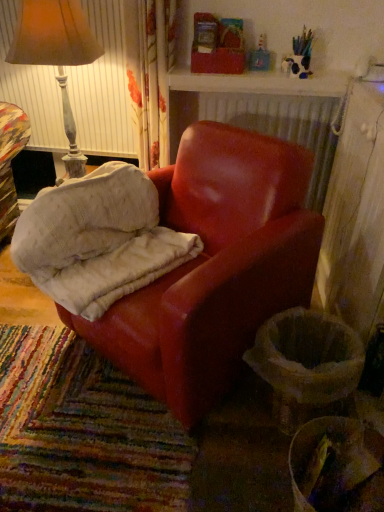
Question: From a real-world perspective, is matte leather chair at center on top of matte brown lampshade at upper left?

Choices:
 (A) yes
 (B) no

Answer: (B)

Question: Is matte leather chair at center closer to camera compared to matte brown lampshade at upper left?

Choices:
 (A) yes
 (B) no

Answer: (A)

Question: Can you confirm if matte leather chair at center is wider than matte brown lampshade at upper left?

Choices:
 (A) no
 (B) yes

Answer: (B)

Question: Is matte leather chair at center further to camera compared to matte brown lampshade at upper left?

Choices:
 (A) yes
 (B) no

Answer: (B)

Question: Considering the relative sizes of matte leather chair at center and matte brown lampshade at upper left in the image provided, is matte leather chair at center bigger than matte brown lampshade at upper left?

Choices:
 (A) yes
 (B) no

Answer: (A)

Question: From a real-world perspective, is matte leather chair at center beneath matte brown lampshade at upper left?

Choices:
 (A) yes
 (B) no

Answer: (A)

Question: Is matte brown lampshade at upper left positioned with its back to matte leather chair at center?

Choices:
 (A) yes
 (B) no

Answer: (B)

Question: Considering the relative sizes of matte brown lampshade at upper left and matte leather chair at center in the image provided, is matte brown lampshade at upper left smaller than matte leather chair at center?

Choices:
 (A) yes
 (B) no

Answer: (A)

Question: Considering the relative sizes of matte brown lampshade at upper left and matte leather chair at center in the image provided, is matte brown lampshade at upper left shorter than matte leather chair at center?

Choices:
 (A) yes
 (B) no

Answer: (A)

Question: From a real-world perspective, is matte brown lampshade at upper left on matte leather chair at center?

Choices:
 (A) no
 (B) yes

Answer: (B)

Question: Is matte brown lampshade at upper left not close to matte leather chair at center?

Choices:
 (A) no
 (B) yes

Answer: (A)

Question: Can you confirm if matte brown lampshade at upper left is positioned to the left of matte leather chair at center?

Choices:
 (A) no
 (B) yes

Answer: (B)

Question: Is matte brown lampshade at upper left bigger than suede-like red armchair at center?

Choices:
 (A) yes
 (B) no

Answer: (B)